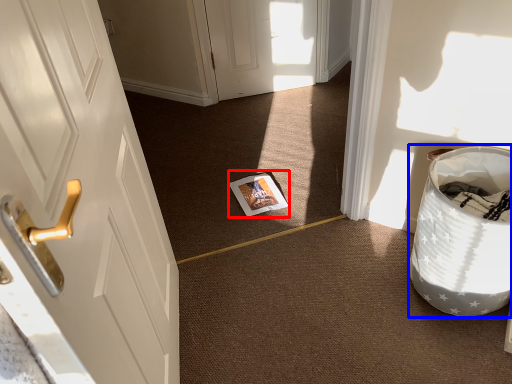
Question: Which object appears closest to the camera in this image, magazine (highlighted by a red box) or laundry basket (highlighted by a blue box)?

Choices:
 (A) magazine
 (B) laundry basket

Answer: (B)